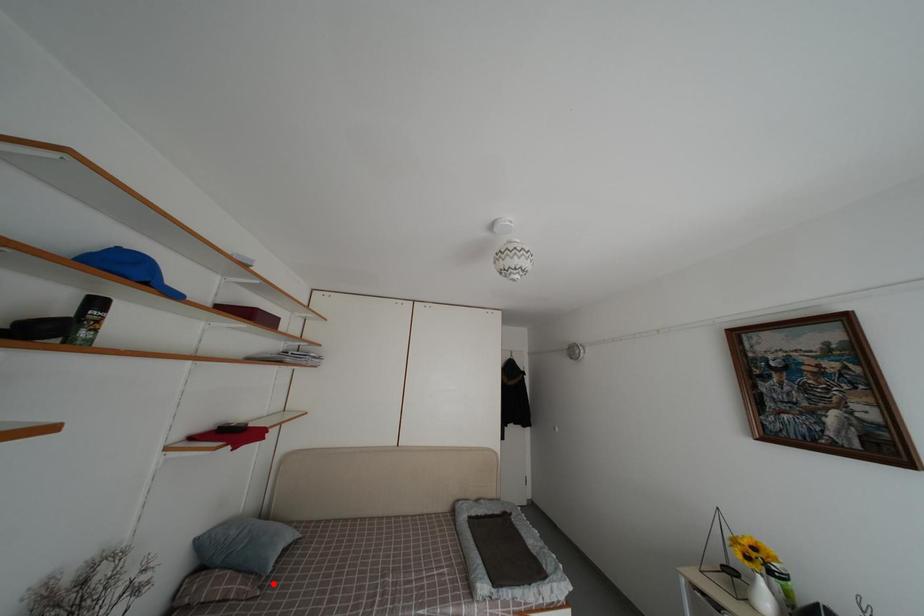
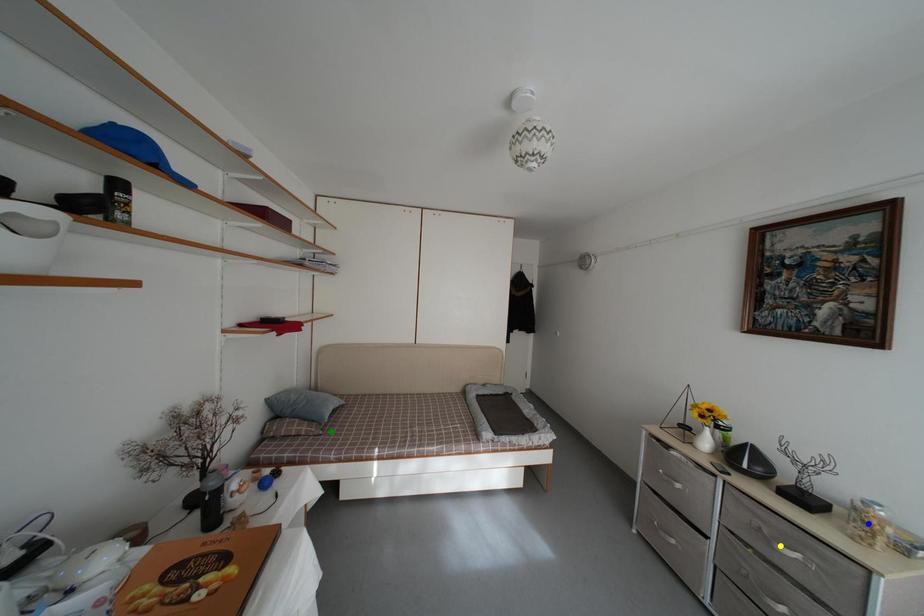
Question: I am providing you with two images of the same scene from different viewpoints. A red point is marked on the first image. You are given multiple points on the second image. Which spot in image 2 lines up with the point in image 1?

Choices:
 (A) yellow point
 (B) blue point
 (C) green point

Answer: (C)